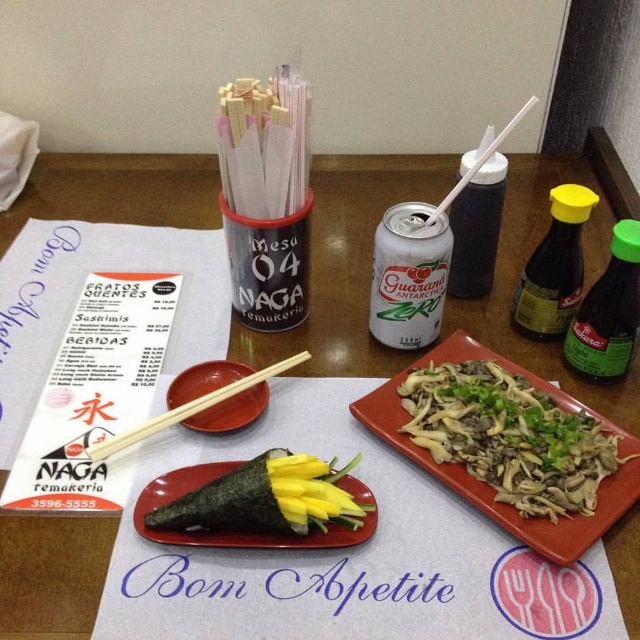
Can you confirm if white matte can at center is positioned above white plastic chopsticks at upper center?

Incorrect, white matte can at center is not positioned above white plastic chopsticks at upper center.

Is point (412, 257) more distant than point (442, 209)?

That is False.

Find the location of a particular element. white matte can at center is located at coordinates (408, 275).

You are a GUI agent. You are given a task and a screenshot of the screen. Output one action in this format:
    pyautogui.click(x=<x>, y=<y>)
    Task: Click on the green nori leaf at center
    
    Given the screenshot: What is the action you would take?
    pyautogui.click(x=266, y=499)

Can you confirm if green nori leaf at center is positioned to the right of matte wood chopsticks at center?

Yes, green nori leaf at center is to the right of matte wood chopsticks at center.

In the scene shown: Measure the distance between point (336, 512) and camera.

Point (336, 512) and camera are 19.00 inches apart from each other.

Find the location of a particular element. The height and width of the screenshot is (640, 640). green nori leaf at center is located at coordinates (266, 499).

Is green leafy vegetables at center thinner than dark brown glass soy sauce at right?

No, green leafy vegetables at center is not thinner than dark brown glass soy sauce at right.

Between green leafy vegetables at center and dark brown glass soy sauce at right, which one has less height?

green leafy vegetables at center is shorter.

This screenshot has width=640, height=640. I want to click on green leafy vegetables at center, so click(509, 436).